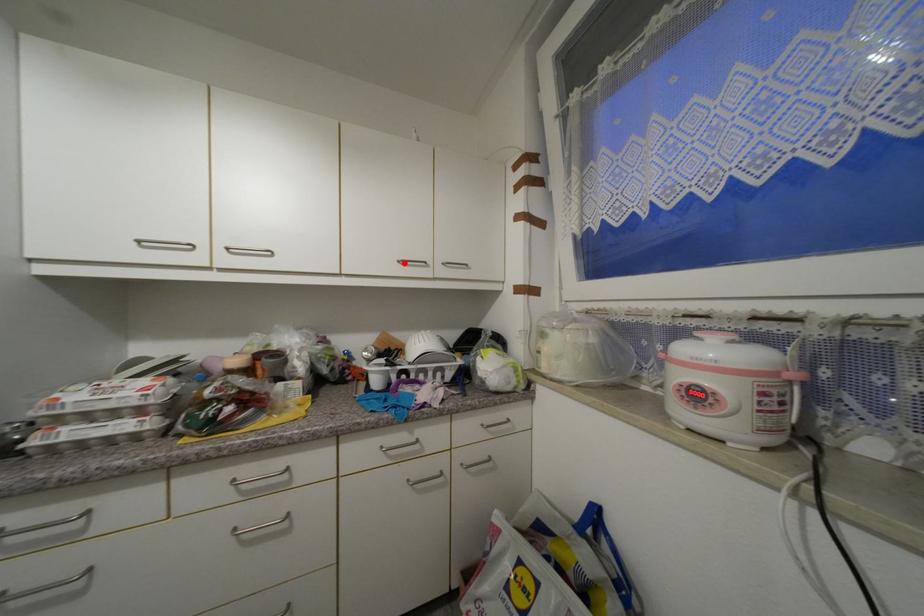
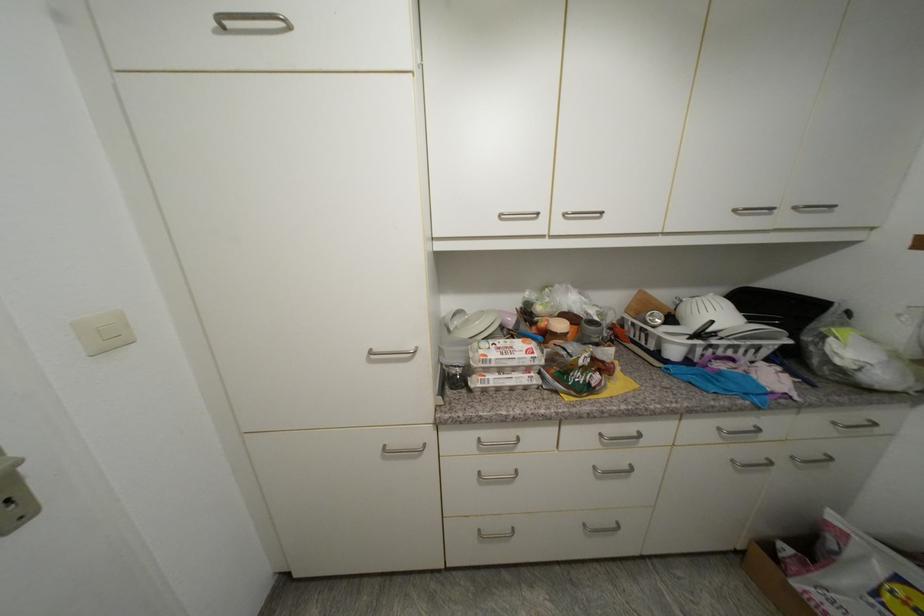
Find the pixel in the second image that matches the highlighted location in the first image.

(740, 213)